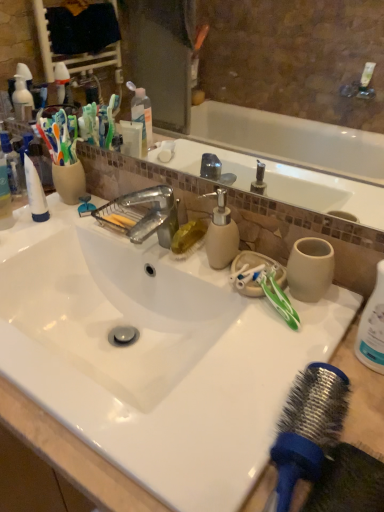
Question: From a real-world perspective, is beige matte soap dispenser at center beneath glossy ceramic mirror at upper center?

Choices:
 (A) yes
 (B) no

Answer: (A)

Question: Can we say beige matte soap dispenser at center lies outside glossy ceramic mirror at upper center?

Choices:
 (A) yes
 (B) no

Answer: (A)

Question: Is beige matte soap dispenser at center smaller than glossy ceramic mirror at upper center?

Choices:
 (A) no
 (B) yes

Answer: (B)

Question: Considering the relative positions of beige matte soap dispenser at center and glossy ceramic mirror at upper center in the image provided, is beige matte soap dispenser at center behind glossy ceramic mirror at upper center?

Choices:
 (A) yes
 (B) no

Answer: (A)

Question: Is beige matte soap dispenser at center thinner than glossy ceramic mirror at upper center?

Choices:
 (A) no
 (B) yes

Answer: (A)

Question: Is beige matte soap dispenser at center taller than glossy ceramic mirror at upper center?

Choices:
 (A) yes
 (B) no

Answer: (B)

Question: Is beige matte soap dispenser at center thinner than white glossy sink at center?

Choices:
 (A) yes
 (B) no

Answer: (A)

Question: From a real-world perspective, does beige matte soap dispenser at center sit lower than white glossy sink at center?

Choices:
 (A) no
 (B) yes

Answer: (A)

Question: Is beige matte soap dispenser at center bigger than white glossy sink at center?

Choices:
 (A) yes
 (B) no

Answer: (B)

Question: Does beige matte soap dispenser at center appear on the left side of white glossy sink at center?

Choices:
 (A) no
 (B) yes

Answer: (A)

Question: From the image's perspective, is beige matte soap dispenser at center above white glossy sink at center?

Choices:
 (A) yes
 (B) no

Answer: (A)

Question: Does beige matte soap dispenser at center come in front of white glossy sink at center?

Choices:
 (A) yes
 (B) no

Answer: (B)

Question: Considering the relative sizes of blue rubber hair brush at lower right and beige matte soap dispenser at center in the image provided, is blue rubber hair brush at lower right shorter than beige matte soap dispenser at center?

Choices:
 (A) yes
 (B) no

Answer: (A)